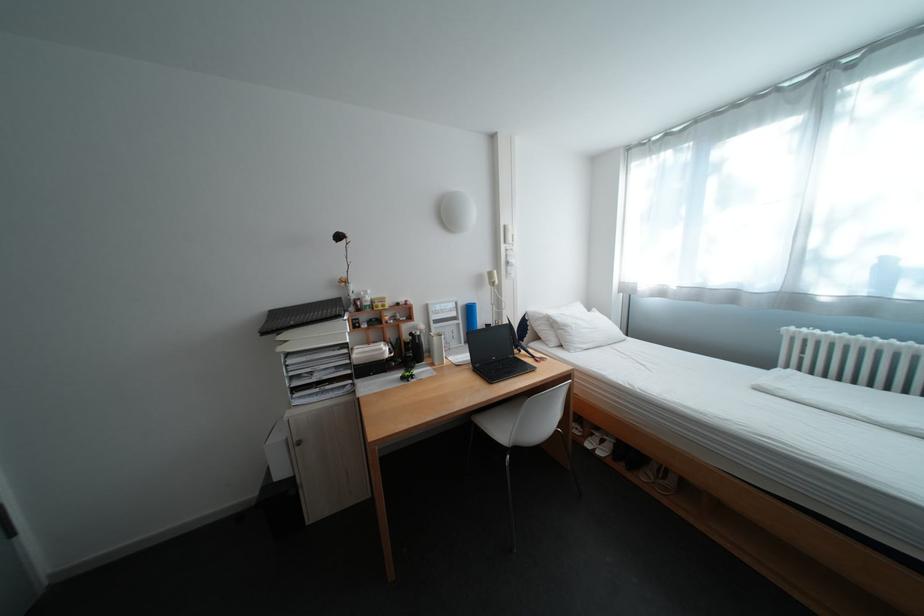
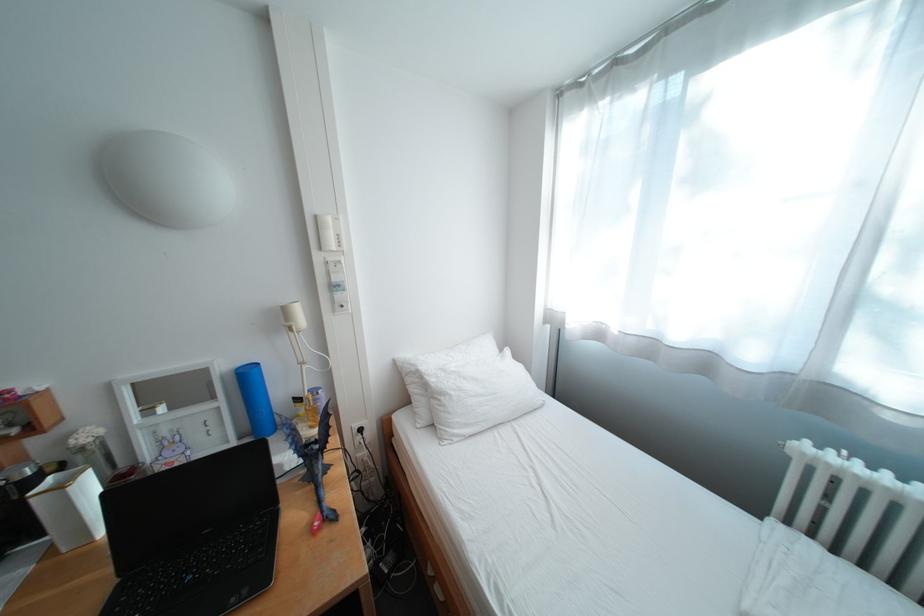
In a continuous first-person perspective shot, in which direction is the camera moving?

The cameraman moved toward right, forward.